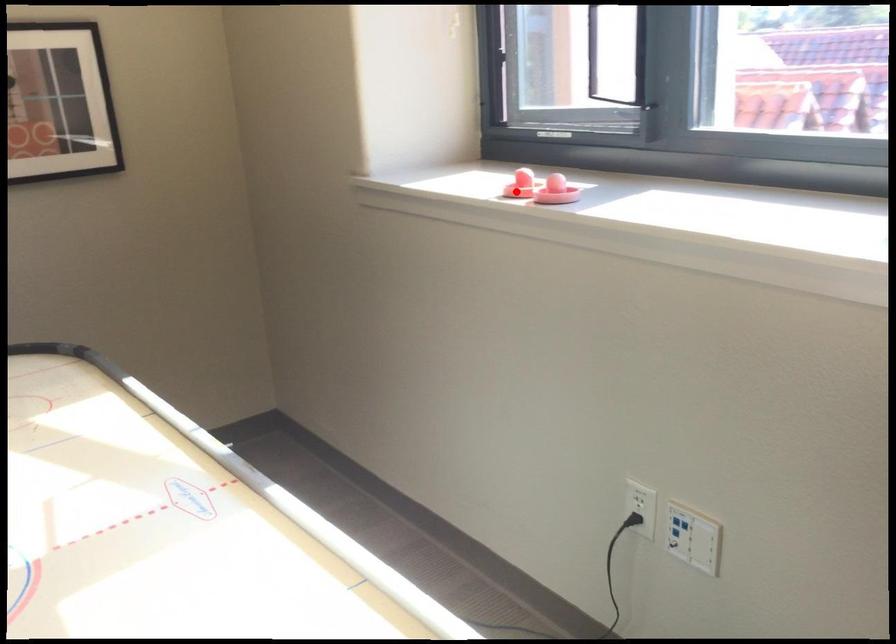
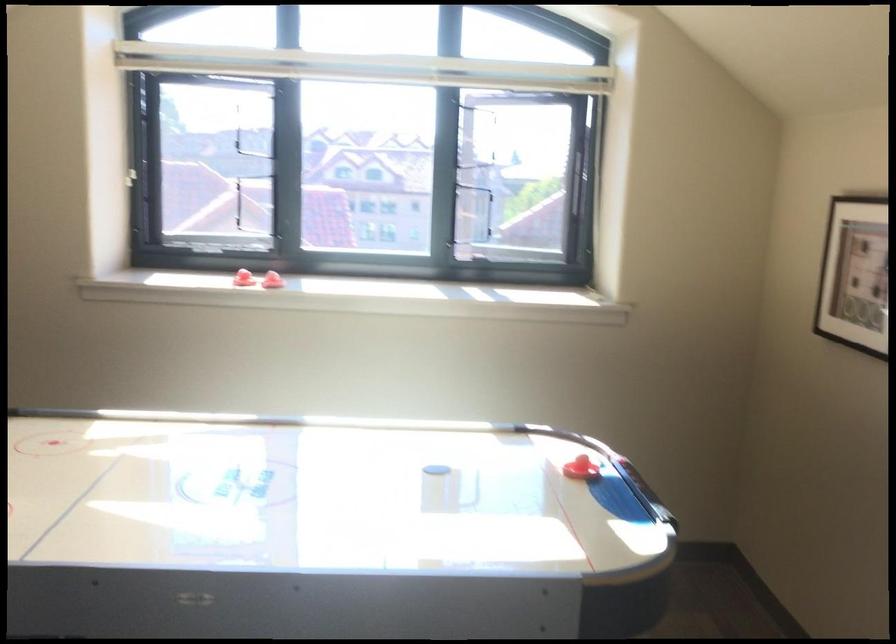
Find the pixel in the second image that matches the highlighted location in the first image.

(244, 279)